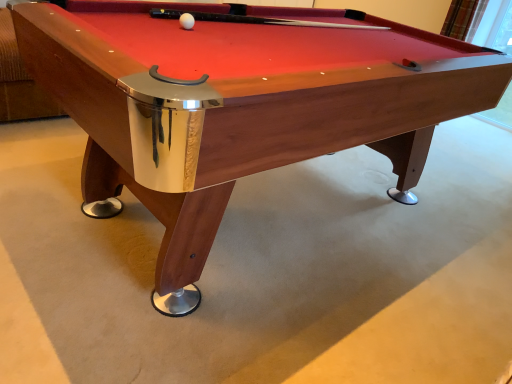
What is the approximate height of white matte ball at center?

1.80 inches.

In order to face white matte ball at center, should I rotate leftwards or rightwards?

To face it directly, rotate left by 9.227 degrees.

What do you see at coordinates (187, 21) in the screenshot? The width and height of the screenshot is (512, 384). I see `white matte ball at center` at bounding box center [187, 21].

Locate an element on the screen. white matte ball at center is located at coordinates (187, 21).

Locate an element on the screen. This screenshot has width=512, height=384. white matte ball at center is located at coordinates (187, 21).